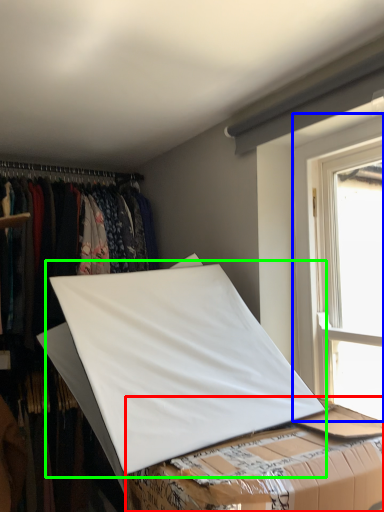
Question: Considering the real-world distances, which object is closest to table (highlighted by a red box)? window (highlighted by a blue box) or linen (highlighted by a green box).

Choices:
 (A) window
 (B) linen

Answer: (B)